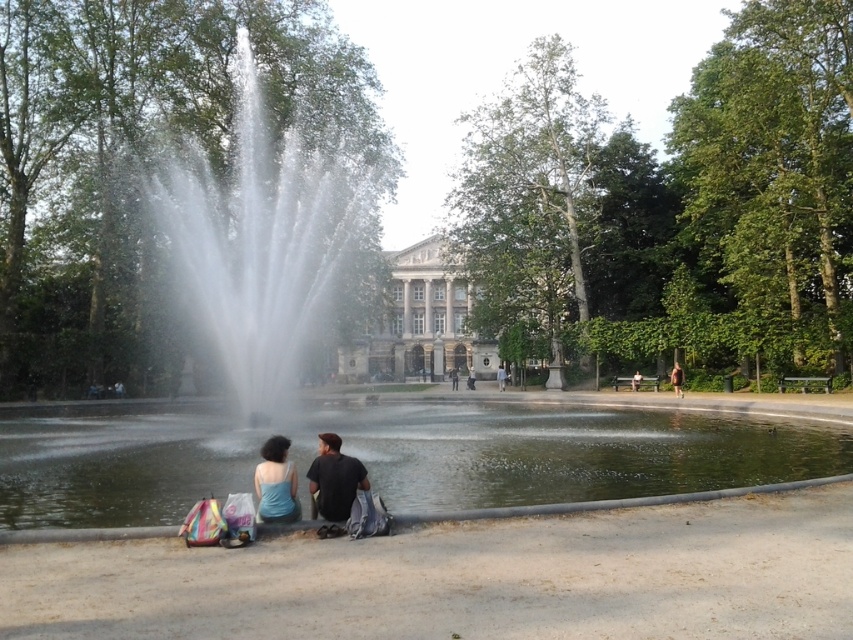
Question: Which of these objects is positioned farthest from the light blue fabric jacket at center?

Choices:
 (A) blue matte tank top at lower center
 (B) clear water fountain at center
 (C) black matte shirt at lower center
 (D) white stone building at center

Answer: (A)

Question: From the image, what is the correct spatial relationship of clear water at center in relation to black matte shirt at lower center?

Choices:
 (A) left
 (B) right

Answer: (B)

Question: Among these points, which one is farthest from the camera?

Choices:
 (A) (679, 385)
 (B) (389, 413)
 (C) (334, 449)
 (D) (292, 506)

Answer: (A)

Question: Is clear water fountain at center smaller than blue matte tank top at lower center?

Choices:
 (A) no
 (B) yes

Answer: (A)

Question: Does black matte shirt at lower center appear under blue matte tank top at lower center?

Choices:
 (A) no
 (B) yes

Answer: (B)

Question: Among these objects, which one is nearest to the camera?

Choices:
 (A) brown leather jacket at lower center
 (B) black matte shirt at lower center
 (C) clear water fountain at center

Answer: (B)